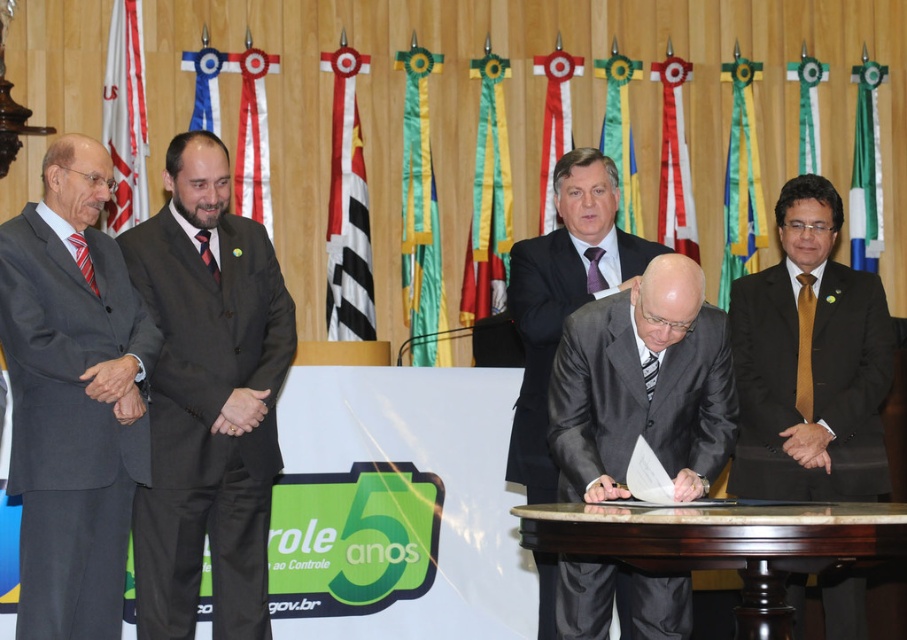
Question: Which point is farther to the camera?

Choices:
 (A) white fabric ribbon at upper center
 (B) red silk tie at center
 (C) green satin ribbon at center
 (D) green fabric flag at upper right

Answer: (D)

Question: Can you confirm if white fabric ribbon at upper center is positioned to the right of striped fabric tie at center?

Choices:
 (A) yes
 (B) no

Answer: (A)

Question: Does matte black suit at left come in front of matte black suit at center?

Choices:
 (A) no
 (B) yes

Answer: (B)

Question: Estimate the real-world distances between objects in this image. Which object is farther from the green satin ribbon at center?

Choices:
 (A) white fabric ribbon at upper center
 (B) dark gray suit at center
 (C) matte black suit at right

Answer: (B)

Question: Which object is farther from the camera taking this photo?

Choices:
 (A) gold silk tie at right
 (B) striped fabric tie at left
 (C) matte black suit at right
 (D) green satin ribbon at center

Answer: (D)

Question: Does dark gray suit at center appear on the right side of brown polished wood table at center?

Choices:
 (A) no
 (B) yes

Answer: (A)